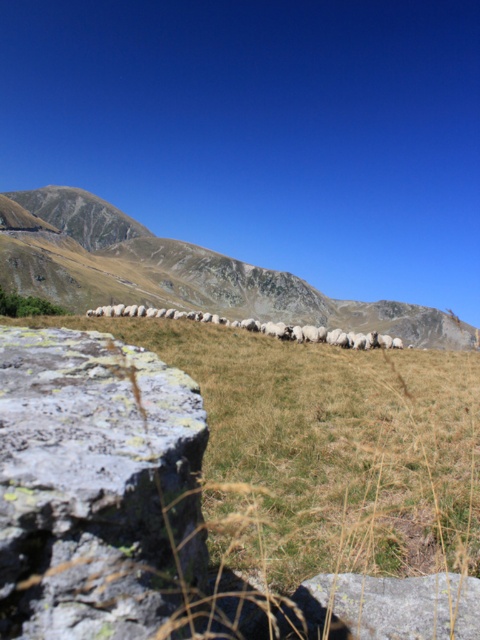
You are a hiker who wants to take a photo of the brown rocky mountain at center and the white woolly sheep at center. Your camera can focus on objects within 200 meters. Will both subjects be in focus?

The brown rocky mountain at center and white woolly sheep at center are 210.19 meters apart. Since the camera can only focus within 200 meters, the distance between them exceeds the focus range, so both subjects cannot be in focus simultaneously.

You are a hiker standing at the base of the mountains and see the gray rough rock at lower left and the gray rough rock at lower right. Which rock is closer to you?

The gray rough rock at lower left is closer to you because it is in front of the gray rough rock at lower right.

You are a hiker standing at the lower left corner of the image. You want to walk to the white woolly sheep at center without stepping on the gray rough rock at lower right. Which direction should you head towards?

The gray rough rock at lower right is to the left of the white woolly sheep at center. So, to avoid stepping on the gray rough rock at lower right, you should head towards the right side of the white woolly sheep at center.